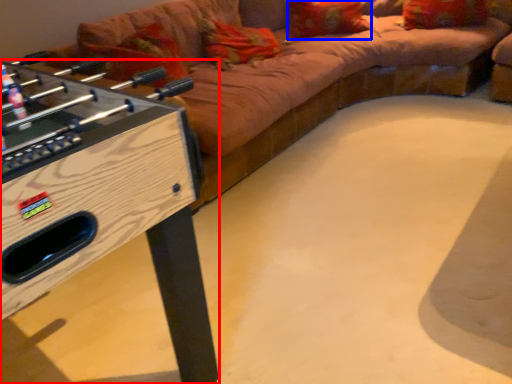
Question: Which object is further to the camera taking this photo, furniture (highlighted by a red box) or pillow (highlighted by a blue box)?

Choices:
 (A) furniture
 (B) pillow

Answer: (B)